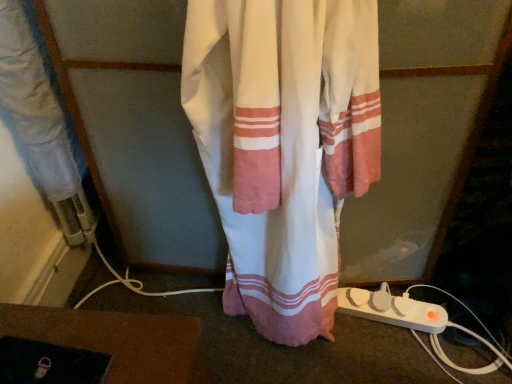
Question: Is white plastic extension cord at lower right wider or thinner than white cotton curtain at center?

Choices:
 (A) thin
 (B) wide

Answer: (A)

Question: From the image's perspective, is white plastic extension cord at lower right above or below white cotton curtain at center?

Choices:
 (A) below
 (B) above

Answer: (A)

Question: Is white plastic extension cord at lower right bigger or smaller than white cotton curtain at center?

Choices:
 (A) small
 (B) big

Answer: (A)

Question: Is white cotton curtain at center taller or shorter than white plastic extension cord at lower right?

Choices:
 (A) short
 (B) tall

Answer: (B)

Question: Is white cotton curtain at center to the left or to the right of white plastic extension cord at lower right in the image?

Choices:
 (A) right
 (B) left

Answer: (B)

Question: Is white cotton curtain at center wider or thinner than white plastic extension cord at lower right?

Choices:
 (A) thin
 (B) wide

Answer: (B)

Question: From a real-world perspective, is white cotton curtain at center positioned above or below white plastic extension cord at lower right?

Choices:
 (A) above
 (B) below

Answer: (A)